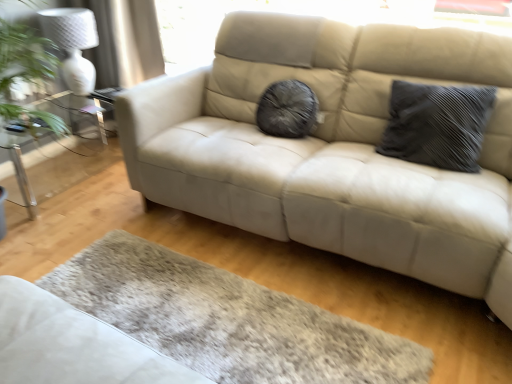
This screenshot has width=512, height=384. Identify the location of dark gray textured pillow at right. coord(437,125).

Can you tell me how much clear glass table at left and white textured lamp at upper left differ in facing direction?

There is a 0.37-degree angle between the facing directions of clear glass table at left and white textured lamp at upper left.

Locate an element on the screen. The width and height of the screenshot is (512, 384). table that is on the left side of white textured lamp at upper left is located at coordinates (57, 157).

Considering the points (57, 101) and (51, 34), which point is in front, point (57, 101) or point (51, 34)?

The point (51, 34) is more forward.

Looking at their sizes, would you say clear glass table at left is wider or thinner than white textured lamp at upper left?

Clearly, clear glass table at left has more width compared to white textured lamp at upper left.

From the image's perspective, between dark gray textured pillow at right and white textured lamp at upper left, which one is located above?

white textured lamp at upper left.

Can you see dark gray textured pillow at right touching white textured lamp at upper left?

No, dark gray textured pillow at right is not in contact with white textured lamp at upper left.

Is dark gray textured pillow at right facing away from white textured lamp at upper left?

No, dark gray textured pillow at right's orientation is not away from white textured lamp at upper left.

Which is behind, point (407, 84) or point (68, 22)?

Point (68, 22)

Is dark gray textured pillow at right further to the viewer compared to clear glass table at left?

No, dark gray textured pillow at right is closer to the camera.

Which object is wider, dark gray textured pillow at right or clear glass table at left?

clear glass table at left is wider.

Is dark gray textured pillow at right not inside clear glass table at left?

Absolutely, dark gray textured pillow at right is external to clear glass table at left.

Is clear glass table at left at the back of dark gray textured pillow at right?

No, clear glass table at left is not at the back of dark gray textured pillow at right.

Is clear glass table at left aimed at dark gray textured pillow at right?

Yes, clear glass table at left is facing dark gray textured pillow at right.

Which of these two, clear glass table at left or dark gray textured pillow at right, is wider?

Wider between the two is clear glass table at left.

Between clear glass table at left and dark gray textured pillow at right, which one appears on the right side from the viewer's perspective?

dark gray textured pillow at right is more to the right.

This screenshot has height=384, width=512. I want to click on table that is under the dark gray textured pillow at right (from a real-world perspective), so click(x=57, y=157).

Is white textured lamp at upper left turned away from clear glass table at left?

No, white textured lamp at upper left's orientation is not away from clear glass table at left.

Can you confirm if white textured lamp at upper left is positioned to the left of clear glass table at left?

In fact, white textured lamp at upper left is to the right of clear glass table at left.

Is point (90, 28) positioned after point (45, 179)?

No, it is in front of (45, 179).

Which object is closer to the camera taking this photo, white textured lamp at upper left or clear glass table at left?

clear glass table at left is more forward.

Is white textured lamp at upper left to the left of dark gray textured pillow at right from the viewer's perspective?

Yes, white textured lamp at upper left is to the left of dark gray textured pillow at right.

Which point is more forward, (89, 12) or (418, 156)?

Result: The point (418, 156) is closer to the camera.

Does white textured lamp at upper left turn towards dark gray textured pillow at right?

Yes.

In order to click on lamp above the dark gray textured pillow at right (from the image's perspective) in this screenshot , I will do `click(73, 44)`.

Find the location of a particular element. The height and width of the screenshot is (384, 512). lamp positioned vertically above the clear glass table at left (from a real-world perspective) is located at coordinates (73, 44).

Identify the location of pillow below the white textured lamp at upper left (from the image's perspective). This screenshot has height=384, width=512. (437, 125).

From the image, which object appears to be farther from white textured lamp at upper left, clear glass table at left or dark gray textured pillow at right?

The object further to white textured lamp at upper left is dark gray textured pillow at right.

Based on their spatial positions, is white textured lamp at upper left or dark gray textured pillow at right closer to clear glass table at left?

Based on the image, white textured lamp at upper left appears to be nearer to clear glass table at left.

In the scene shown: Based on their spatial positions, is dark gray textured pillow at right or clear glass table at left further from white textured lamp at upper left?

dark gray textured pillow at right is positioned further to the anchor white textured lamp at upper left.

In the scene shown: Looking at the image, which one is located closer to dark gray textured pillow at right, white textured lamp at upper left or clear glass table at left?

white textured lamp at upper left.

When comparing their distances from dark gray textured pillow at right, does clear glass table at left or white textured lamp at upper left seem further?

clear glass table at left is further to dark gray textured pillow at right.

Based on their spatial positions, is dark gray textured pillow at right or white textured lamp at upper left further from clear glass table at left?

dark gray textured pillow at right is further to clear glass table at left.

You are a GUI agent. You are given a task and a screenshot of the screen. Output one action in this format:
    pyautogui.click(x=<x>, y=<y>)
    Task: Click on the lamp between clear glass table at left and dark gray textured pillow at right
    Image resolution: width=512 pixels, height=384 pixels.
    Given the screenshot: What is the action you would take?
    pyautogui.click(x=73, y=44)